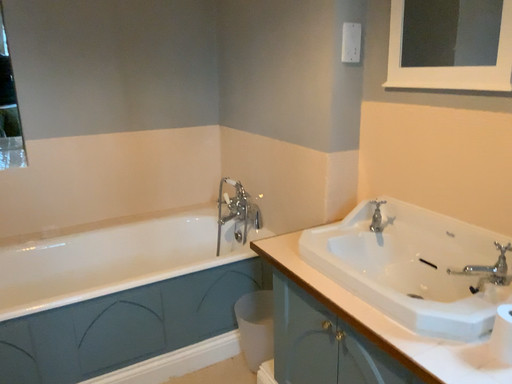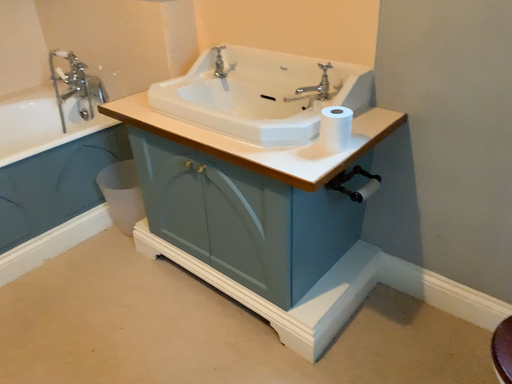
Question: How did the camera likely rotate when shooting the video?

Choices:
 (A) rotated left
 (B) rotated right

Answer: (B)